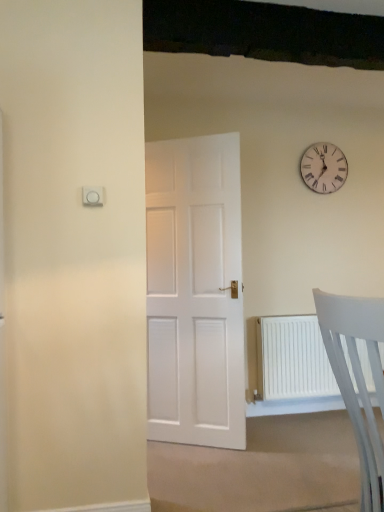
Question: Considering the relative sizes of white plastic chair at lower right and white wooden clock at upper right in the image provided, is white plastic chair at lower right shorter than white wooden clock at upper right?

Choices:
 (A) yes
 (B) no

Answer: (B)

Question: Is white plastic chair at lower right to the left of white wooden clock at upper right from the viewer's perspective?

Choices:
 (A) no
 (B) yes

Answer: (B)

Question: Is white plastic chair at lower right far away from white wooden clock at upper right?

Choices:
 (A) yes
 (B) no

Answer: (A)

Question: Is white plastic chair at lower right taller than white wooden clock at upper right?

Choices:
 (A) yes
 (B) no

Answer: (A)

Question: From the image's perspective, is white plastic chair at lower right located beneath white wooden clock at upper right?

Choices:
 (A) no
 (B) yes

Answer: (B)

Question: From a real-world perspective, is white plastic chair at lower right positioned under white wooden clock at upper right based on gravity?

Choices:
 (A) yes
 (B) no

Answer: (A)

Question: Does white wooden clock at upper right appear on the left side of white plastic chair at lower right?

Choices:
 (A) no
 (B) yes

Answer: (A)

Question: Is white wooden clock at upper right positioned in front of white plastic chair at lower right?

Choices:
 (A) no
 (B) yes

Answer: (A)

Question: Can you confirm if white wooden clock at upper right is smaller than white plastic chair at lower right?

Choices:
 (A) yes
 (B) no

Answer: (A)

Question: From a real-world perspective, is white wooden clock at upper right physically above white plastic chair at lower right?

Choices:
 (A) yes
 (B) no

Answer: (A)

Question: Is white wooden clock at upper right beside white plastic chair at lower right?

Choices:
 (A) yes
 (B) no

Answer: (B)

Question: Does white wooden clock at upper right appear on the right side of white plastic chair at lower right?

Choices:
 (A) no
 (B) yes

Answer: (B)

Question: In terms of size, does white plastic chair at lower right appear bigger or smaller than white wooden clock at upper right?

Choices:
 (A) big
 (B) small

Answer: (A)